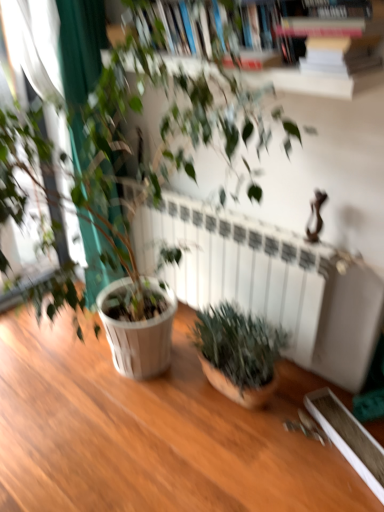
Find the location of a particular element. empty space that is ontop of white matte radiator at center (from a real-world perspective) is located at coordinates (219, 210).